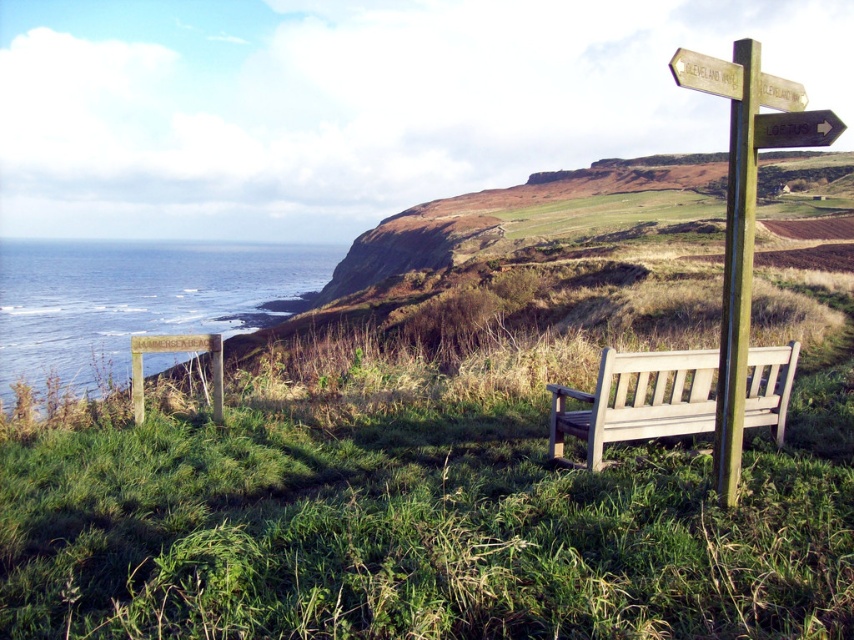
You are a visitor at Numbershire Beach and want to take a photo of the wooden bench at right and the wooden signpost at right. Which object should you focus on first if you want to capture both in your frame without moving your camera?

Since the wooden bench at right is shorter than the wooden signpost at right, you should focus on the wooden signpost at right first to ensure both objects are in the frame without moving the camera.